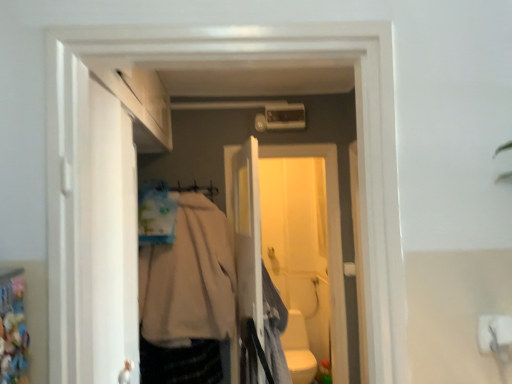
Question: Is white matte door at left wider or thinner than beige fabric coat at center, the second clothing in the right-to-left sequence?

Choices:
 (A) wide
 (B) thin

Answer: (B)

Question: From a real-world perspective, is white matte door at left above or below beige fabric coat at center, the second clothing in the right-to-left sequence?

Choices:
 (A) below
 (B) above

Answer: (B)

Question: Which object is the farthest from the white plastic screen door at center, acting as the 2th screen door starting from the front?

Choices:
 (A) light gray fabric at center, marked as the 1th clothing in a right-to-left arrangement
 (B) beige fabric hanger at center
 (C) white plastic screen door at center, which is counted as the first screen door, starting from the front
 (D) beige fabric coat at center, the second clothing in the right-to-left sequence
 (E) white glossy toilet bowl at lower center

Answer: (E)

Question: Estimate the real-world distances between objects in this image. Which object is farther from the white glossy toilet bowl at lower center?

Choices:
 (A) beige fabric hanger at center
 (B) light gray fabric at center, which is the 2th clothing in left-to-right order
 (C) white matte door at left
 (D) white plastic screen door at center, which ranks as the second screen door in back-to-front order
 (E) white plastic screen door at center, acting as the 2th screen door starting from the front

Answer: (C)